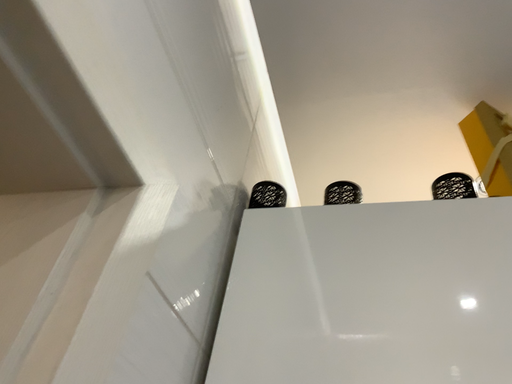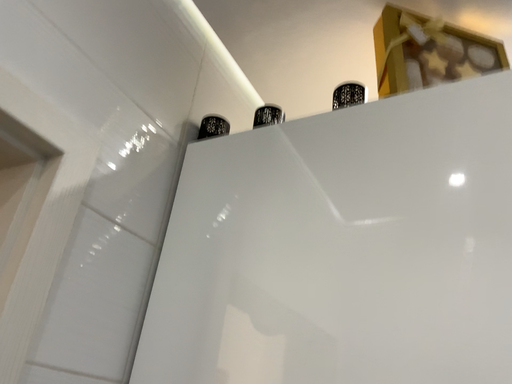
Question: Which way did the camera rotate in the video?

Choices:
 (A) rotated downward
 (B) rotated upward

Answer: (A)